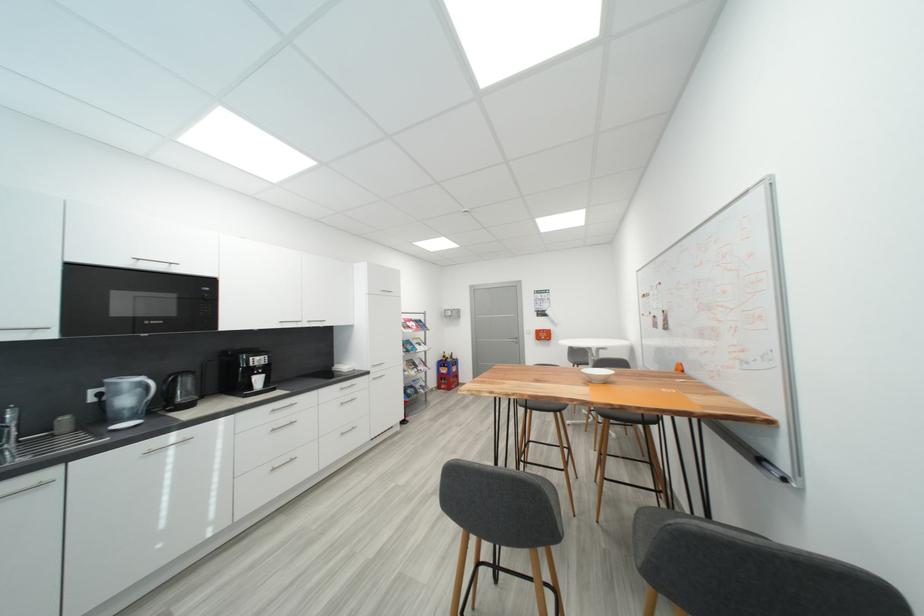
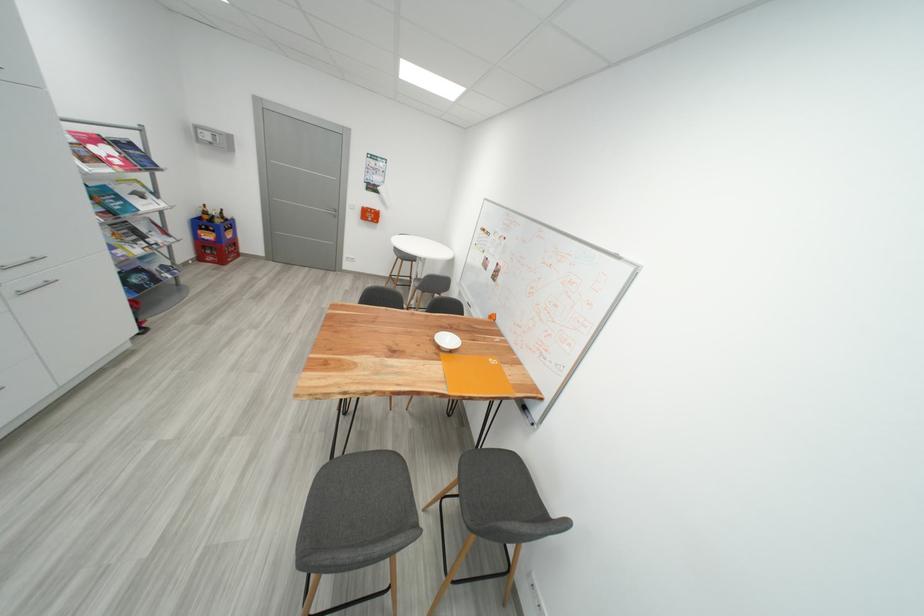
The point at (416, 329) is marked in the first image. Where is the corresponding point in the second image?

(104, 161)